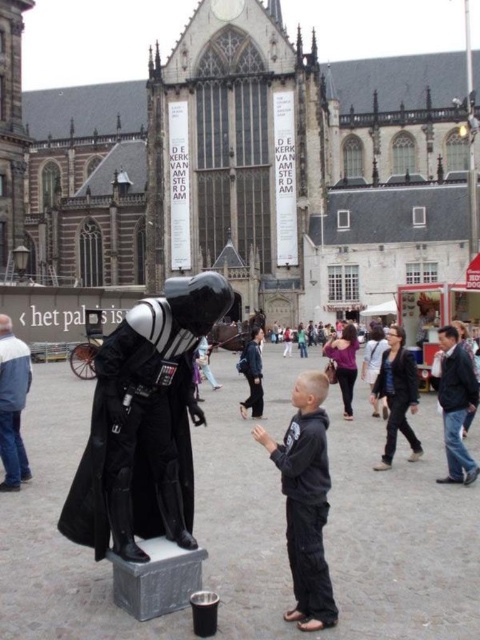
You are standing at the point with coordinates point (252, 339) and want to walk towards the historic building. Is the point point (116, 467) between you and the building?

Yes, the point (116, 467) is between you and the building because it is in front of point (252, 339) where you are standing.

You are a photographer trying to capture both the shiny black armor at center and the dark gray hoodie at center in a single frame. Based on their positions and sizes, which object should you focus on to ensure both are fully visible in your photo?

The shiny black armor at center might be wider than dark gray hoodie at center, so focusing on the shiny black armor at center would help ensure both are fully visible in the photo.